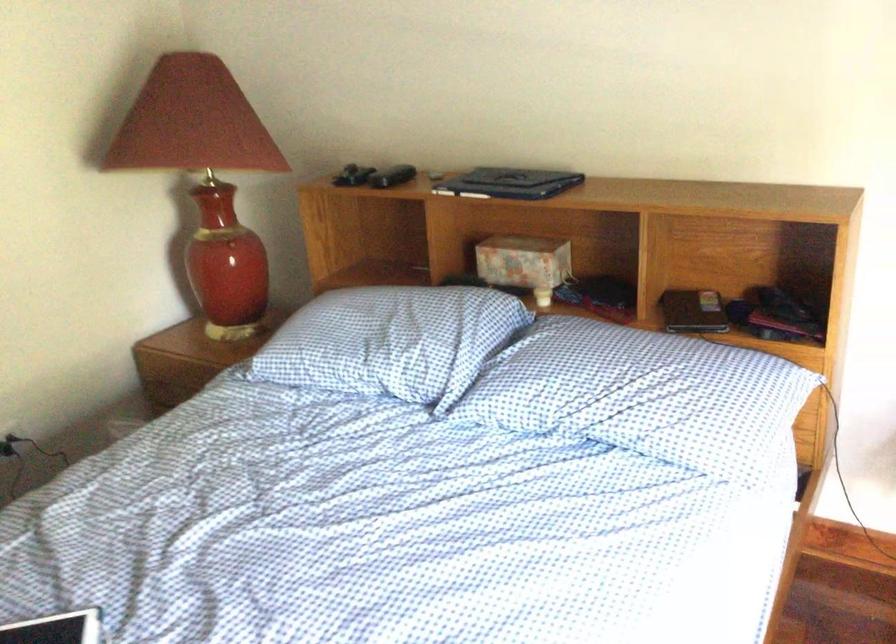
Find where to turn the lamp switch. Please return your answer as a coordinate pair (x, y).

(229, 249)